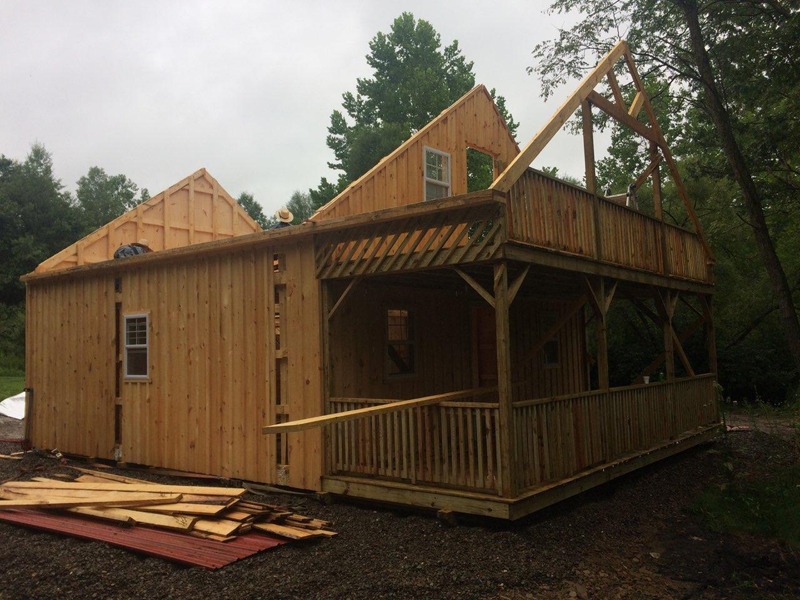
What are the coordinates of `window` in the screenshot? It's located at (138, 342), (434, 170), (404, 338), (553, 346).